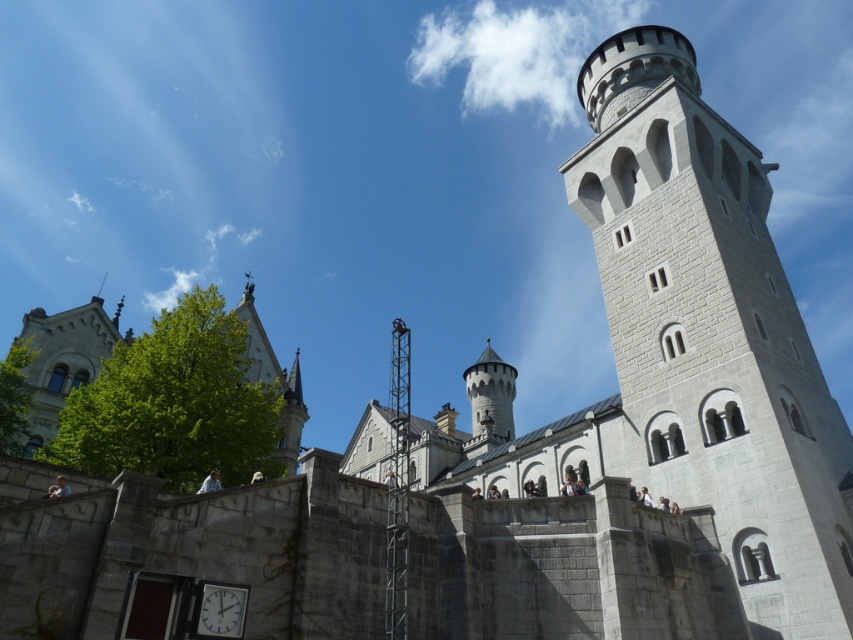
Question: Is white stone tower at upper right closer to camera compared to white plastic clock at lower center?

Choices:
 (A) yes
 (B) no

Answer: (B)

Question: Can you confirm if white stone tower at upper right is bigger than white plastic clock at lower center?

Choices:
 (A) yes
 (B) no

Answer: (A)

Question: Does white stone tower at upper right appear over white plastic clock at lower center?

Choices:
 (A) no
 (B) yes

Answer: (B)